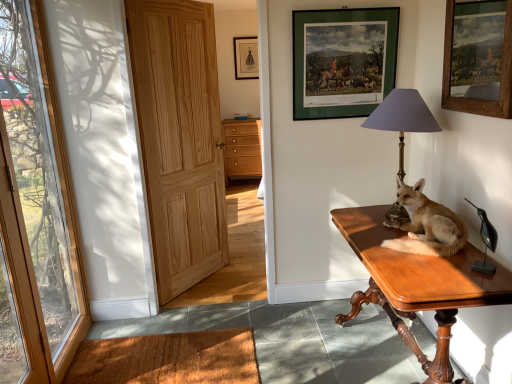
Question: From a real-world perspective, is black glossy bird at right positioned over green matte picture frame at upper center, which is counted as the 2th picture frame, starting from the top, based on gravity?

Choices:
 (A) no
 (B) yes

Answer: (A)

Question: Is black glossy bird at right outside green matte picture frame at upper center, positioned as the second picture frame in right-to-left order?

Choices:
 (A) yes
 (B) no

Answer: (A)

Question: Can you confirm if black glossy bird at right is shorter than green matte picture frame at upper center, the 2th picture frame viewed from the back?

Choices:
 (A) yes
 (B) no

Answer: (A)

Question: From the image's perspective, would you say black glossy bird at right is positioned over green matte picture frame at upper center, the 2th picture frame viewed from the back?

Choices:
 (A) no
 (B) yes

Answer: (A)

Question: Considering the relative sizes of black glossy bird at right and green matte picture frame at upper center, positioned as the second picture frame in right-to-left order, in the image provided, is black glossy bird at right bigger than green matte picture frame at upper center, positioned as the second picture frame in right-to-left order,?

Choices:
 (A) no
 (B) yes

Answer: (A)

Question: In terms of width, does brown shaggy carpet at lower left look wider or thinner when compared to brown coir mat at lower left?

Choices:
 (A) thin
 (B) wide

Answer: (A)

Question: In the image, is brown shaggy carpet at lower left positioned in front of or behind brown coir mat at lower left?

Choices:
 (A) front
 (B) behind

Answer: (A)

Question: Does point (316, 337) appear closer or farther from the camera than point (192, 362)?

Choices:
 (A) farther
 (B) closer

Answer: (A)

Question: From the image's perspective, is brown shaggy carpet at lower left located above or below brown coir mat at lower left?

Choices:
 (A) below
 (B) above

Answer: (B)

Question: In the image, is brown fur stuffed fox at right positioned in front of or behind black glossy bird at right?

Choices:
 (A) behind
 (B) front

Answer: (A)

Question: Considering the positions of brown fur stuffed fox at right and black glossy bird at right in the image, is brown fur stuffed fox at right taller or shorter than black glossy bird at right?

Choices:
 (A) short
 (B) tall

Answer: (B)

Question: From the image's perspective, is brown fur stuffed fox at right located above or below black glossy bird at right?

Choices:
 (A) below
 (B) above

Answer: (B)

Question: From a real-world perspective, is brown fur stuffed fox at right positioned above or below black glossy bird at right?

Choices:
 (A) above
 (B) below

Answer: (A)

Question: Considering the positions of wooden door at left, which ranks as the first door in left-to-right order, and brown coir mat at lower left in the image, is wooden door at left, which ranks as the first door in left-to-right order, taller or shorter than brown coir mat at lower left?

Choices:
 (A) short
 (B) tall

Answer: (B)

Question: Looking at the image, does wooden door at left, which ranks as the first door in left-to-right order, seem bigger or smaller compared to brown coir mat at lower left?

Choices:
 (A) small
 (B) big

Answer: (B)